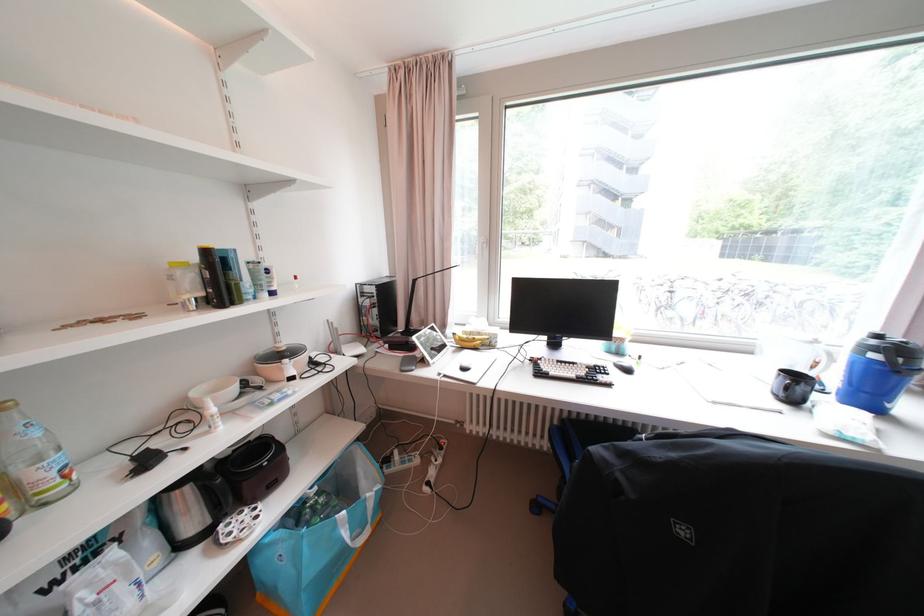
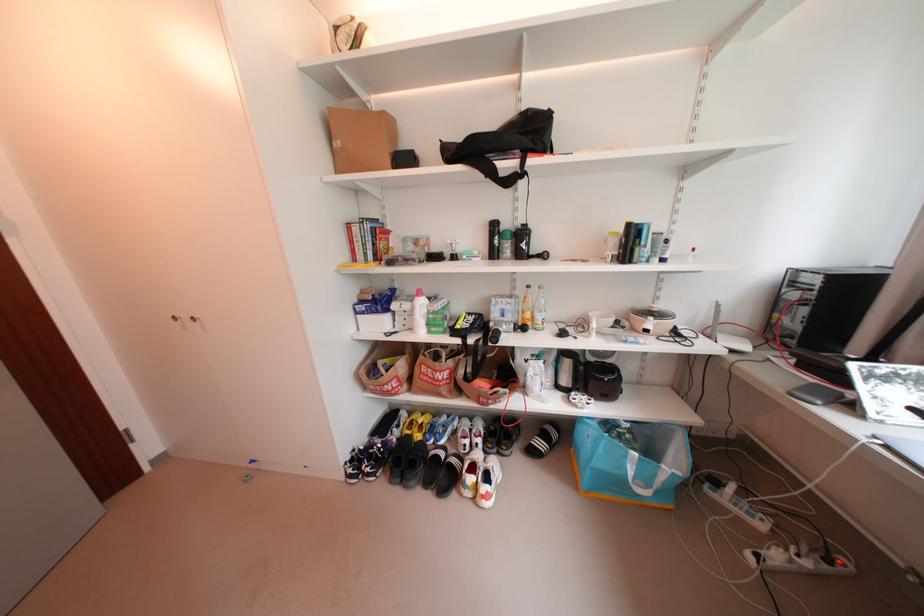
In the second image, find the point that corresponds to [294,362] in the first image.

(660, 320)